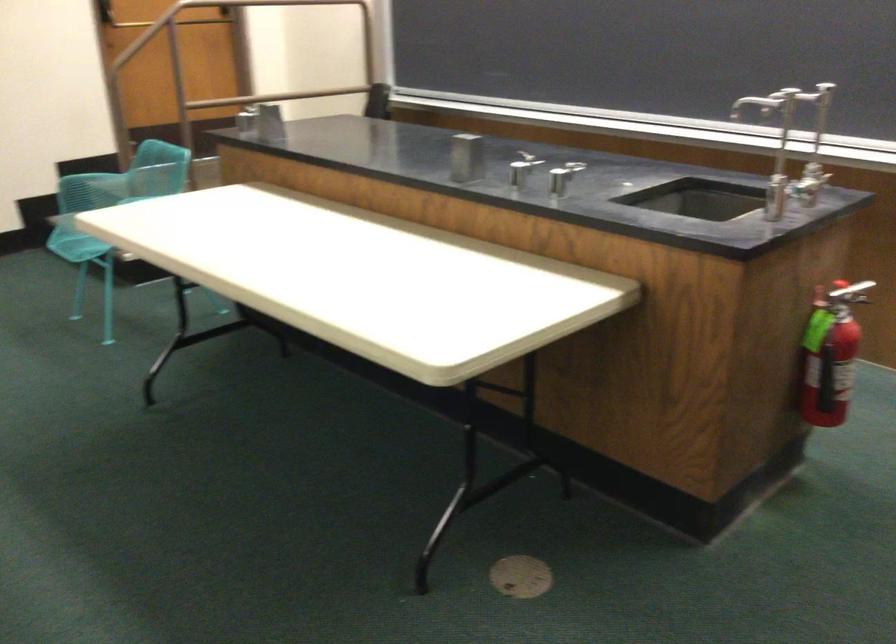
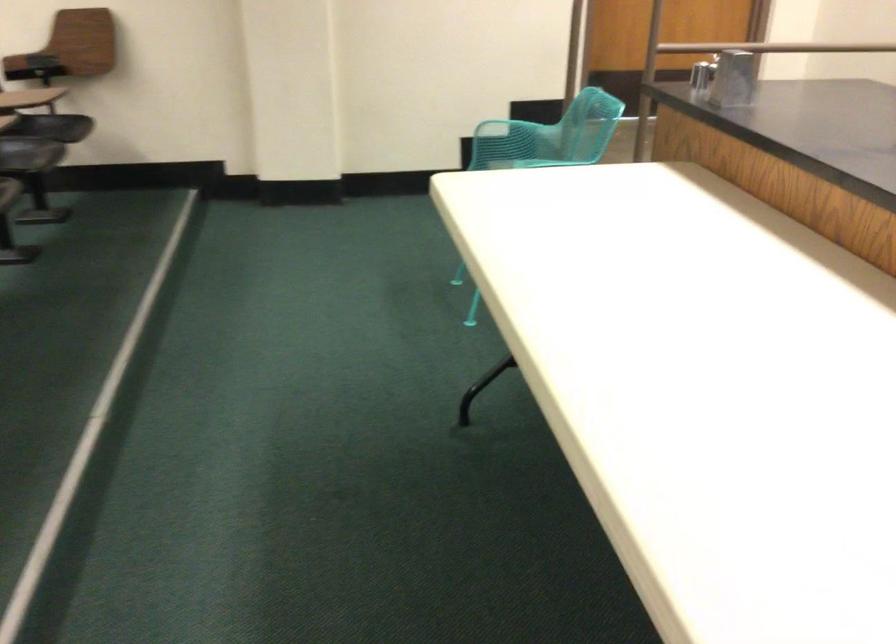
Question: The images are taken continuously from a first-person perspective. In which direction is your viewpoint rotating?

Choices:
 (A) Left
 (B) Right
 (C) Up
 (D) Down

Answer: (A)